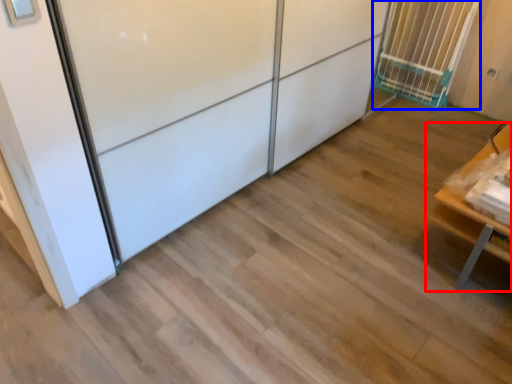
Question: Which point is further to the camera, furniture (highlighted by a red box) or cage (highlighted by a blue box)?

Choices:
 (A) furniture
 (B) cage

Answer: (B)